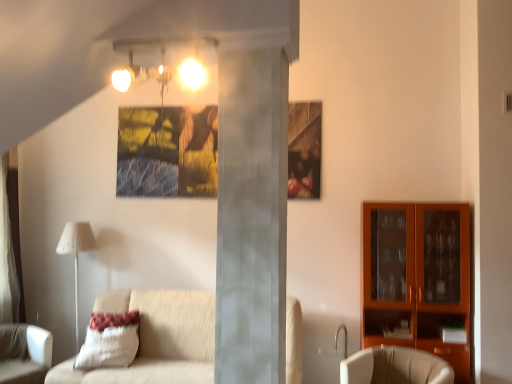
Question: From a real-world perspective, is white fabric curtain at left positioned over beige fabric couch at left based on gravity?

Choices:
 (A) no
 (B) yes

Answer: (B)

Question: Does white fabric curtain at left contain beige fabric couch at left?

Choices:
 (A) yes
 (B) no

Answer: (B)

Question: Does white fabric curtain at left lie behind beige fabric couch at left?

Choices:
 (A) no
 (B) yes

Answer: (B)

Question: Does white fabric curtain at left appear on the right side of beige fabric couch at left?

Choices:
 (A) no
 (B) yes

Answer: (A)

Question: From the image's perspective, does white fabric curtain at left appear lower than beige fabric couch at left?

Choices:
 (A) no
 (B) yes

Answer: (A)

Question: Can you confirm if white fabric curtain at left is shorter than beige fabric couch at left?

Choices:
 (A) yes
 (B) no

Answer: (B)

Question: Does white fabric curtain at left have a smaller size compared to matte glass light fixture at upper center?

Choices:
 (A) no
 (B) yes

Answer: (A)

Question: Is matte glass light fixture at upper center at the back of white fabric curtain at left?

Choices:
 (A) no
 (B) yes

Answer: (A)

Question: Is white fabric curtain at left facing towards matte glass light fixture at upper center?

Choices:
 (A) no
 (B) yes

Answer: (A)

Question: Does white fabric curtain at left have a lesser width compared to matte glass light fixture at upper center?

Choices:
 (A) no
 (B) yes

Answer: (B)

Question: Is white fabric curtain at left far from matte glass light fixture at upper center?

Choices:
 (A) yes
 (B) no

Answer: (A)

Question: Does white fabric curtain at left have a lesser height compared to matte glass light fixture at upper center?

Choices:
 (A) yes
 (B) no

Answer: (B)

Question: From the image's perspective, would you say white fabric chair at lower left, arranged as the first chair when viewed from the left, is positioned over beige fabric chair at lower right, which appears as the 2th chair when viewed from the left?

Choices:
 (A) yes
 (B) no

Answer: (B)